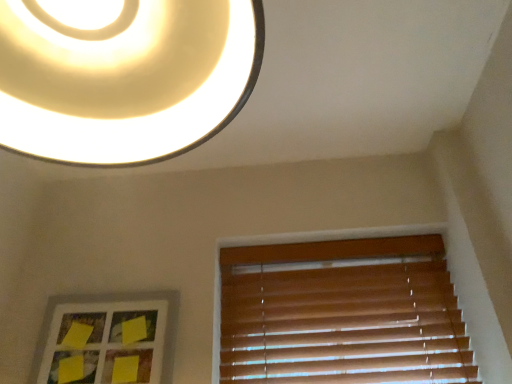
The image size is (512, 384). What do you see at coordinates (109, 335) in the screenshot?
I see `yellow paper at lower left` at bounding box center [109, 335].

What is the approximate height of wooden blinds at lower right?

The height of wooden blinds at lower right is 20.24 inches.

Identify the location of matte white lampshade at upper center. The width and height of the screenshot is (512, 384). (123, 75).

Are matte white lampshade at upper center and wooden blinds at lower right making contact?

No, matte white lampshade at upper center is not next to wooden blinds at lower right.

Is wooden blinds at lower right inside matte white lampshade at upper center?

No, wooden blinds at lower right is not inside matte white lampshade at upper center.

In the image, is matte white lampshade at upper center positioned in front of or behind wooden blinds at lower right?

matte white lampshade at upper center is positioned closer to the viewer than wooden blinds at lower right.

Is point (129, 65) positioned after point (247, 299)?

That is False.

Relative to matte white lampshade at upper center, is wooden blinds at lower right in front or behind?

Clearly, wooden blinds at lower right is behind matte white lampshade at upper center.

Choose the correct answer: Is wooden blinds at lower right inside matte white lampshade at upper center or outside it?

wooden blinds at lower right lies outside matte white lampshade at upper center.

Is wooden blinds at lower right next to matte white lampshade at upper center?

There is a gap between wooden blinds at lower right and matte white lampshade at upper center.

How much distance is there between yellow paper at lower left and wooden blinds at lower right?

yellow paper at lower left is 19.02 inches from wooden blinds at lower right.

Which object is closer to the camera, yellow paper at lower left or wooden blinds at lower right?

yellow paper at lower left.

From the image's perspective, is yellow paper at lower left under wooden blinds at lower right?

Yes, from the image's perspective, yellow paper at lower left is beneath wooden blinds at lower right.

Is yellow paper at lower left directly adjacent to wooden blinds at lower right?

No, yellow paper at lower left is not touching wooden blinds at lower right.

Considering the sizes of objects wooden blinds at lower right and yellow paper at lower left in the image provided, who is bigger, wooden blinds at lower right or yellow paper at lower left?

Bigger between the two is wooden blinds at lower right.

Which object is further away from the camera taking this photo, wooden blinds at lower right or yellow paper at lower left?

wooden blinds at lower right is further from the camera.

Considering the positions of objects wooden blinds at lower right and yellow paper at lower left in the image provided, who is more to the right, wooden blinds at lower right or yellow paper at lower left?

From the viewer's perspective, wooden blinds at lower right appears more on the right side.

Is wooden blinds at lower right facing away from yellow paper at lower left?

wooden blinds at lower right is not turned away from yellow paper at lower left.

Looking at this image, is yellow paper at lower left at the back of matte white lampshade at upper center?

Yes, matte white lampshade at upper center is facing away from yellow paper at lower left.

How different are the orientations of matte white lampshade at upper center and yellow paper at lower left in degrees?

5.44 degrees separate the facing orientations of matte white lampshade at upper center and yellow paper at lower left.

From a real-world perspective, is matte white lampshade at upper center located higher than yellow paper at lower left?

Yes, from a real-world perspective, matte white lampshade at upper center is above yellow paper at lower left.

From the image's perspective, between matte white lampshade at upper center and yellow paper at lower left, who is located below?

yellow paper at lower left, from the image's perspective.

Considering the positions of objects yellow paper at lower left and matte white lampshade at upper center in the image provided, who is more to the right, yellow paper at lower left or matte white lampshade at upper center?

matte white lampshade at upper center.

From the image's perspective, relative to matte white lampshade at upper center, is yellow paper at lower left above or below?

From the image's perspective, yellow paper at lower left appears below matte white lampshade at upper center.

Is yellow paper at lower left oriented away from matte white lampshade at upper center?

No, yellow paper at lower left is not facing the opposite direction of matte white lampshade at upper center.

Are yellow paper at lower left and matte white lampshade at upper center far apart?

That's not correct — yellow paper at lower left is a little close to matte white lampshade at upper center.

Where is `window blind lying below the matte white lampshade at upper center (from the image's perspective)`? window blind lying below the matte white lampshade at upper center (from the image's perspective) is located at coordinates (342, 314).

Identify the location of window blind lying on the right of matte white lampshade at upper center. (342, 314).

When comparing their distances from matte white lampshade at upper center, does yellow paper at lower left or wooden blinds at lower right seem closer?

Based on the image, yellow paper at lower left appears to be nearer to matte white lampshade at upper center.

Consider the image. Which object lies further to the anchor point yellow paper at lower left, matte white lampshade at upper center or wooden blinds at lower right?

The object further to yellow paper at lower left is matte white lampshade at upper center.

Consider the image. Estimate the real-world distances between objects in this image. Which object is further from wooden blinds at lower right, yellow paper at lower left or matte white lampshade at upper center?

matte white lampshade at upper center lies further to wooden blinds at lower right than the other object.

Based on their spatial positions, is wooden blinds at lower right or matte white lampshade at upper center closer to yellow paper at lower left?

Based on the image, wooden blinds at lower right appears to be nearer to yellow paper at lower left.

Considering their positions, is wooden blinds at lower right positioned closer to matte white lampshade at upper center than yellow paper at lower left?

yellow paper at lower left is positioned closer to the anchor matte white lampshade at upper center.

Considering their positions, is matte white lampshade at upper center positioned further to wooden blinds at lower right than yellow paper at lower left?

matte white lampshade at upper center is positioned further to the anchor wooden blinds at lower right.

Where is `picture frame between matte white lampshade at upper center and wooden blinds at lower right in the front-back direction`? picture frame between matte white lampshade at upper center and wooden blinds at lower right in the front-back direction is located at coordinates (109, 335).